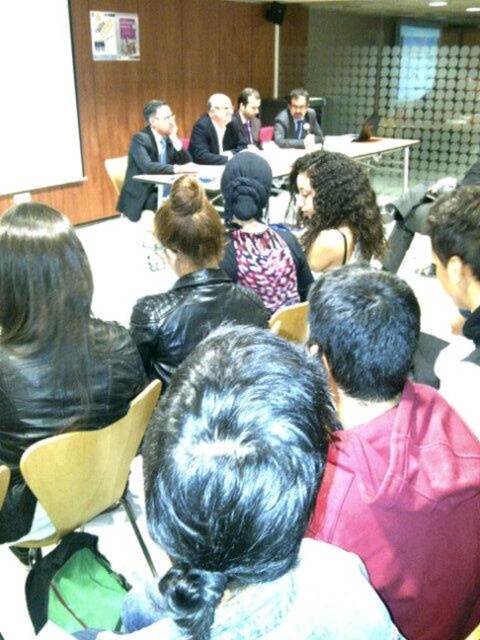
Is maroon hoodie at center above dark suit jacket at center?

Incorrect, maroon hoodie at center is not positioned above dark suit jacket at center.

Which is more to the left, maroon hoodie at center or dark suit jacket at center?

From the viewer's perspective, dark suit jacket at center appears more on the left side.

Find the location of a particular element. maroon hoodie at center is located at coordinates (396, 458).

Between matte black suit at upper left and matte black suit at center, which one is positioned lower?

matte black suit at upper left is below.

Does matte black suit at upper left have a greater width compared to matte black suit at center?

Yes.

Is point (165, 154) farther from camera compared to point (299, 109)?

No, (165, 154) is in front of (299, 109).

The height and width of the screenshot is (640, 480). I want to click on matte black suit at upper left, so click(x=149, y=157).

Which is behind, point (354, 570) or point (168, 300)?

The point (168, 300) is more distant.

Which is below, black leather jacket at center or leather jacket at center?

black leather jacket at center is lower down.

Does point (216, 364) come in front of point (214, 250)?

That is True.

You are a GUI agent. You are given a task and a screenshot of the screen. Output one action in this format:
    pyautogui.click(x=<x>, y=<y>)
    Task: Click on the black leather jacket at center
    This screenshot has width=480, height=640.
    Given the screenshot: What is the action you would take?
    pyautogui.click(x=248, y=500)